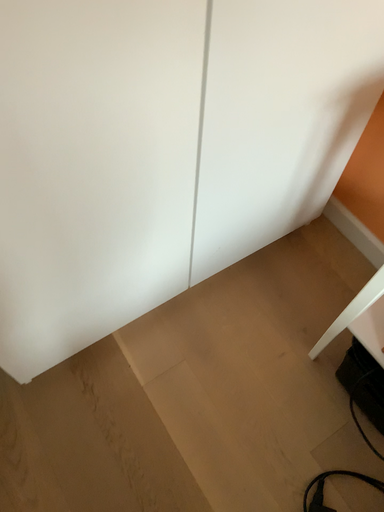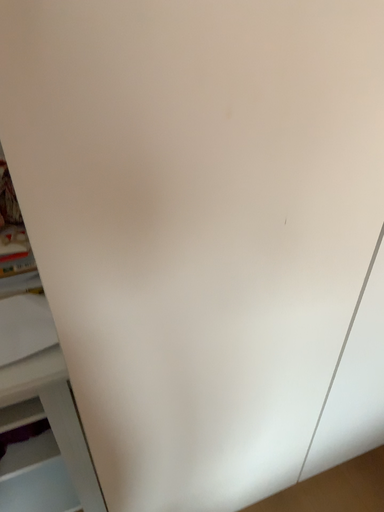
Question: Which way did the camera rotate in the video?

Choices:
 (A) rotated downward
 (B) rotated upward

Answer: (B)